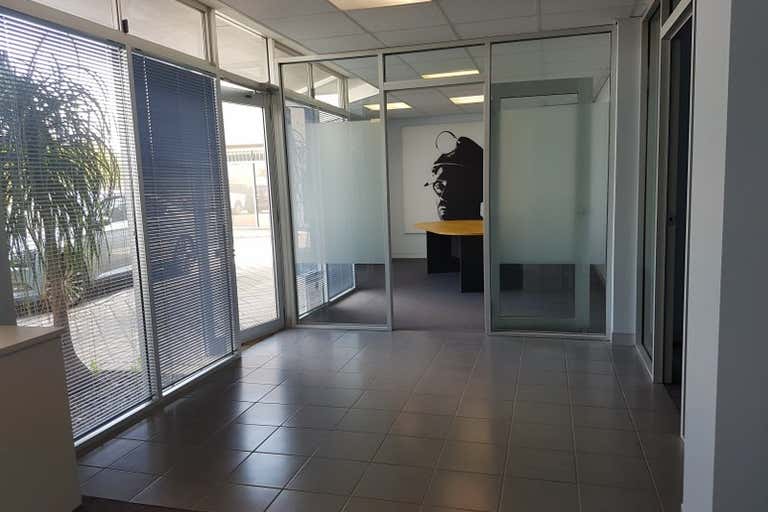
This screenshot has height=512, width=768. In order to click on grey wall in this screenshot , I will do click(749, 371).